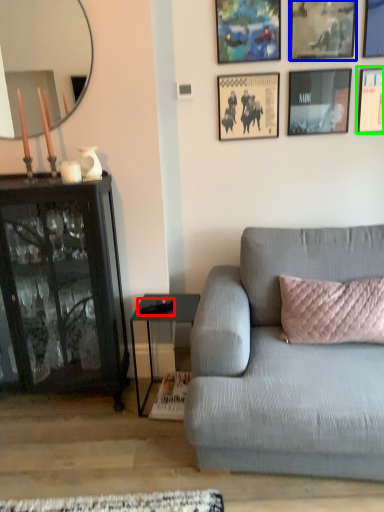
Question: Based on their relative distances, which object is nearer to remote control (highlighted by a red box)? Choose from picture frame (highlighted by a blue box) and picture frame (highlighted by a green box).

Choices:
 (A) picture frame
 (B) picture frame

Answer: (B)